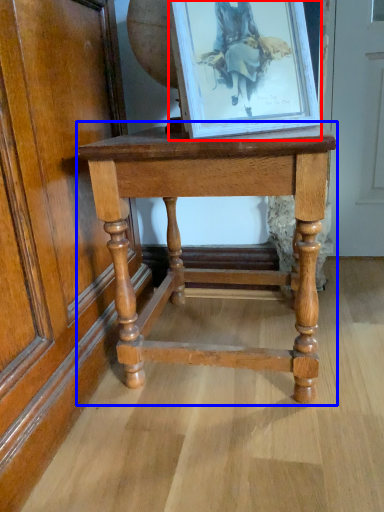
Question: Which object is further to the camera taking this photo, picture frame (highlighted by a red box) or table (highlighted by a blue box)?

Choices:
 (A) picture frame
 (B) table

Answer: (B)